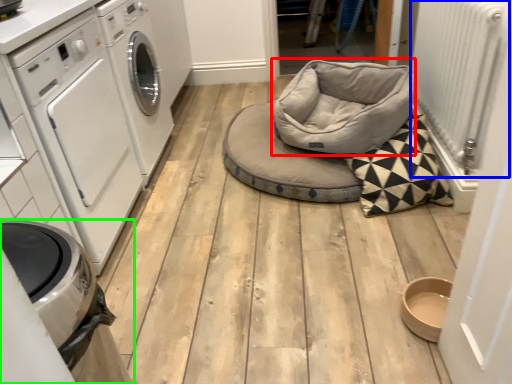
Question: Which object is the closest to the bean bag chair (highlighted by a red box)? Choose among these: radiator (highlighted by a blue box) or home appliance (highlighted by a green box).

Choices:
 (A) radiator
 (B) home appliance

Answer: (A)